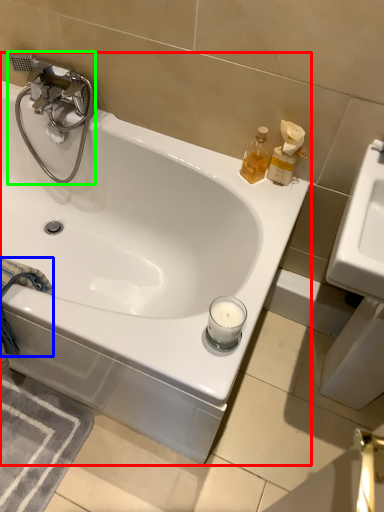
Question: Estimate the real-world distances between objects in this image. Which object is farther from bathtub (highlighted by a red box), bath towel (highlighted by a blue box) or tap (highlighted by a green box)?

Choices:
 (A) bath towel
 (B) tap

Answer: (A)